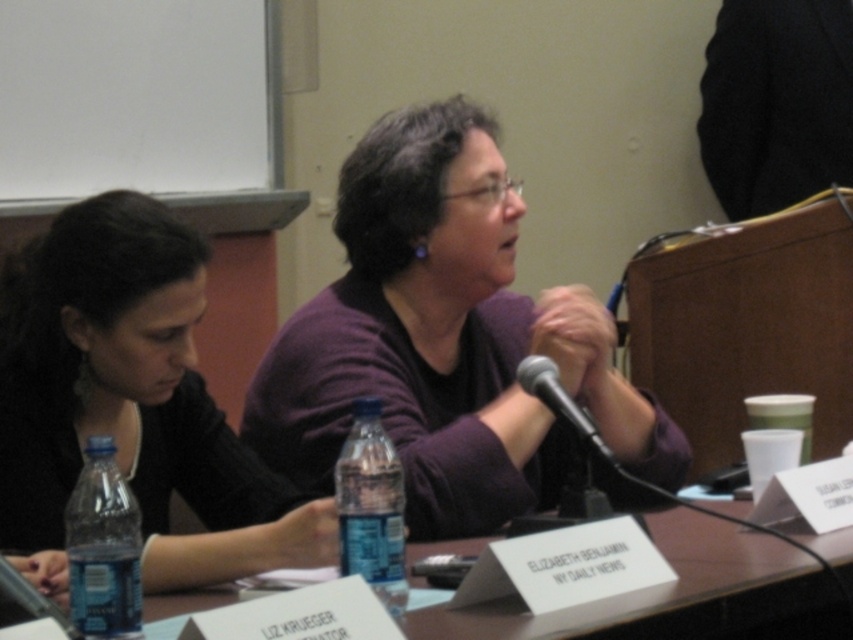
Does point (724, 552) come behind point (544, 378)?

No.

Does point (735, 595) come in front of point (583, 436)?

Yes, it is.

Between point (231, 596) and point (592, 451), which one is positioned in front?

Point (231, 596) is in front.

Image resolution: width=853 pixels, height=640 pixels. I want to click on clear plastic water bottle at lower left, so click(676, 595).

Between clear plastic water bottle at lower left and blue plastic bottle at lower left, which one appears on the left side from the viewer's perspective?

blue plastic bottle at lower left

Is clear plastic water bottle at lower left to the right of blue plastic bottle at lower left from the viewer's perspective?

Indeed, clear plastic water bottle at lower left is positioned on the right side of blue plastic bottle at lower left.

What do you see at coordinates (676, 595) in the screenshot? The height and width of the screenshot is (640, 853). I see `clear plastic water bottle at lower left` at bounding box center [676, 595].

The height and width of the screenshot is (640, 853). Identify the location of clear plastic water bottle at lower left. (676, 595).

The height and width of the screenshot is (640, 853). What do you see at coordinates (103, 547) in the screenshot? I see `blue plastic bottle at lower left` at bounding box center [103, 547].

Can you confirm if blue plastic bottle at lower left is smaller than black metallic microphone at center?

Yes.

You are a GUI agent. You are given a task and a screenshot of the screen. Output one action in this format:
    pyautogui.click(x=<x>, y=<y>)
    Task: Click on the blue plastic bottle at lower left
    This screenshot has height=640, width=853.
    Given the screenshot: What is the action you would take?
    pyautogui.click(x=103, y=547)